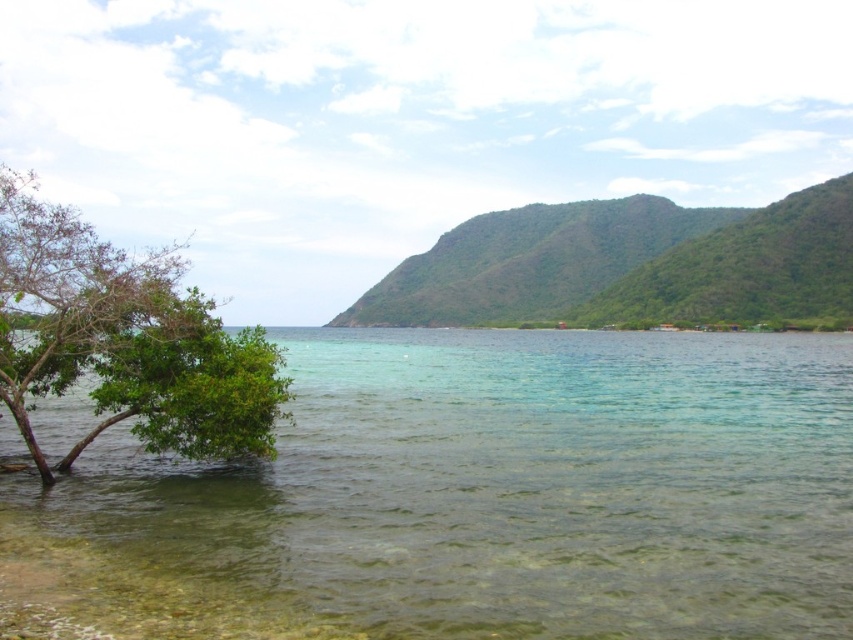
You are standing on the beach and see the clear water at lower left and the green leafy tree at left. Which object is closer to the right side of the scene?

The clear water at lower left is to the right of the green leafy tree at left, so the clear water at lower left is closer to the right side of the scene.

You are standing at the edge of the clear water at lower left and want to reach the green leafy tree at left. Which direction should you walk to get there?

To reach the green leafy tree at left from the clear water at lower left, you should walk towards the left since the clear water at lower left is in front of the tree, meaning the tree is behind it from your current position.